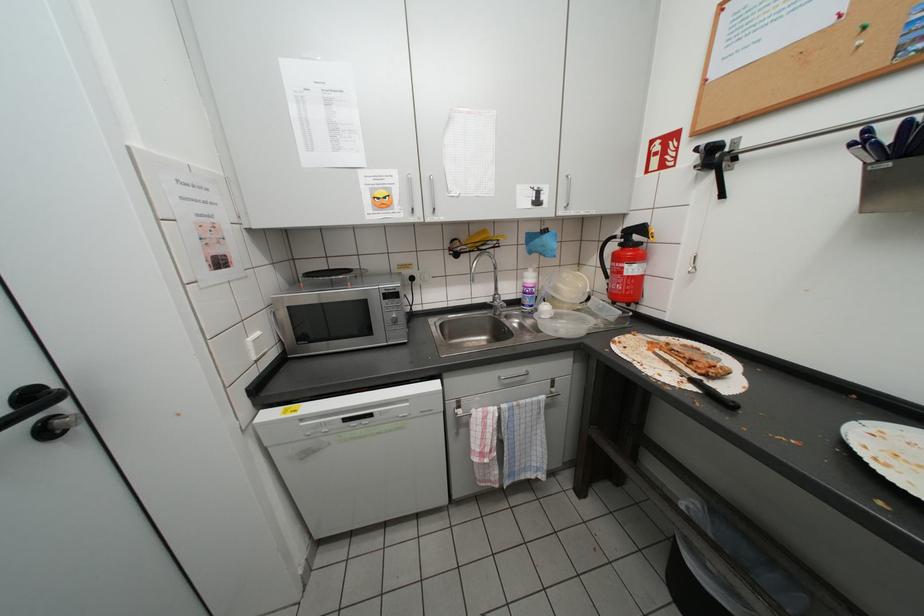
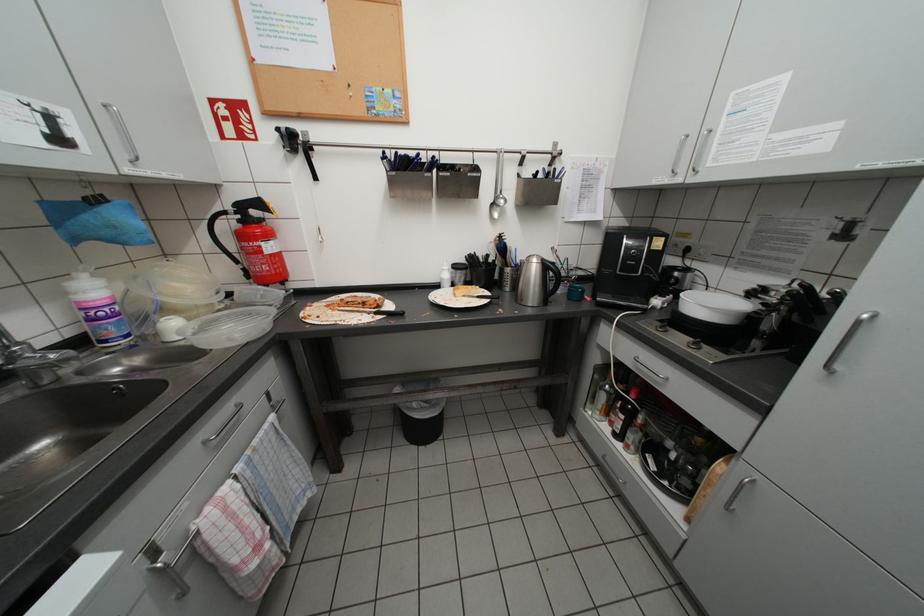
The first image is from the beginning of the video and the second image is from the end. How did the camera likely rotate when shooting the video?

The rotation direction of the camera is right-down.